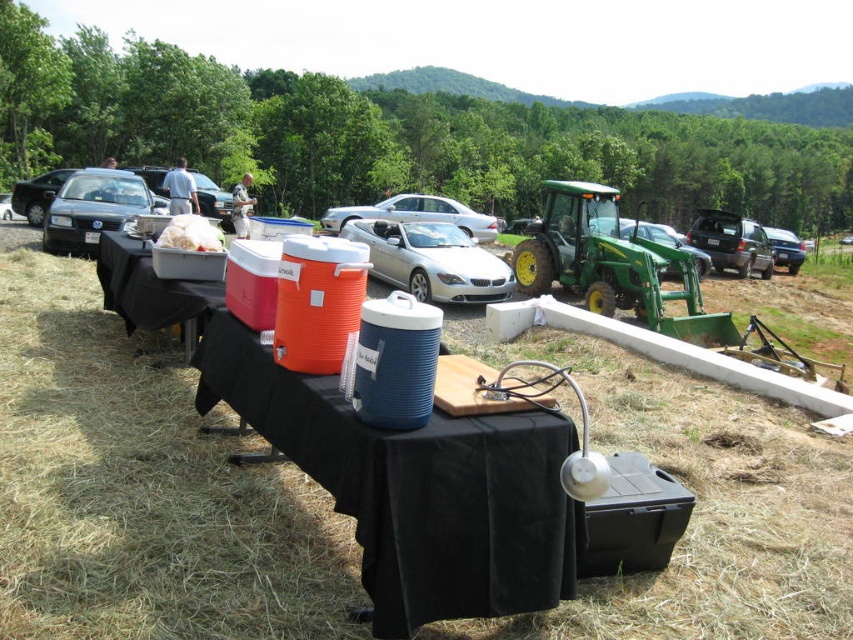
You are planning to park your car in the parking lot near the silver metallic car at center. The parking spots are marked at coordinates ranging from 0.3 to 0.7 on both axes. Can you park your car within these spots?

The silver metallic car at center is located at point (x=431, y=260), which falls within the parking spots marked from 0.3 to 0.7 on both axes. Therefore, you can park your car within these spots.

You are at a picnic and want to place the white fluffy food at center on the black plastic table at lower left. Is the table located in a position that allows you to place the food directly on top of it?

The black plastic table at lower left is below white fluffy food at center, so yes, the table is positioned directly underneath the food, allowing you to place it directly on top.